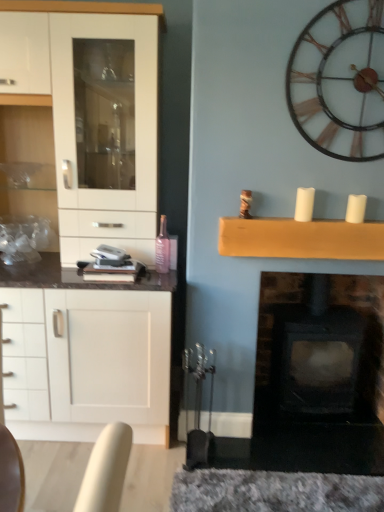
Question: Is white matte candle at upper center, marked as the second candle in a right-to-left arrangement, wider or thinner than white matte candle at upper right, positioned as the 2th candle in left-to-right order?

Choices:
 (A) wide
 (B) thin

Answer: (B)

Question: Does point click(304, 202) appear closer or farther from the camera than point click(354, 214)?

Choices:
 (A) closer
 (B) farther

Answer: (B)

Question: Considering the real-world distances, which object is closest to the white matte candle at upper center, the 1th candle from the left?

Choices:
 (A) metallic brown clock at upper right
 (B) black matte fireplace at center
 (C) wooden mantle at upper center
 (D) white glossy cabinet at left
 (E) white matte candle at upper right, which appears as the first candle when viewed from the right

Answer: (C)

Question: Considering the real-world distances, which object is farthest from the white glossy cabinet at left?

Choices:
 (A) wooden mantle at upper center
 (B) metallic brown clock at upper right
 (C) white matte candle at upper center, the 1th candle from the left
 (D) black matte fireplace at center
 (E) pink glass bottle at center

Answer: (D)